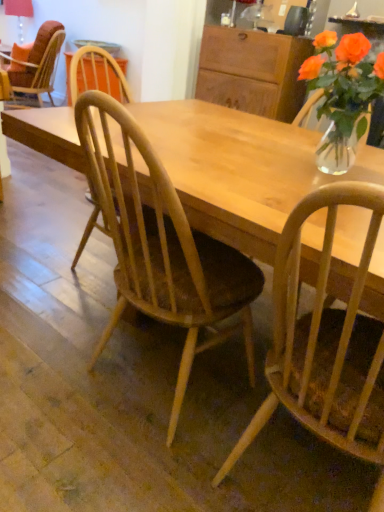
Where is `translucent glass vase at upper right`? The height and width of the screenshot is (512, 384). translucent glass vase at upper right is located at coordinates (342, 94).

Where is `light wood chair at center, which is the 2th chair in front-to-back order`? light wood chair at center, which is the 2th chair in front-to-back order is located at coordinates (162, 248).

Describe the element at coordinates (252, 71) in the screenshot. I see `wooden cabinet at upper center` at that location.

Locate an element on the screen. matte orange fabric chair at upper left, the first chair positioned from the back is located at coordinates (39, 64).

Who is taller, light wood chair at center, which is the 2th chair in front-to-back order, or translucent glass vase at upper right?

Standing taller between the two is light wood chair at center, which is the 2th chair in front-to-back order.

Considering the relative positions of light wood chair at center, which is the 2th chair from bottom to top, and translucent glass vase at upper right in the image provided, is light wood chair at center, which is the 2th chair from bottom to top, behind translucent glass vase at upper right?

No, the depth of light wood chair at center, which is the 2th chair from bottom to top, is less than that of translucent glass vase at upper right.

Is light wood chair at center, which is the 2th chair in front-to-back order, situated inside translucent glass vase at upper right or outside?

light wood chair at center, which is the 2th chair in front-to-back order, is spatially situated outside translucent glass vase at upper right.

Which is farther from the camera, (117, 221) or (337, 145)?

Positioned behind is point (337, 145).

How different are the orientations of matte orange fabric chair at upper left, the 1th chair from the left, and wooden cabinet at upper center in degrees?

The angle between the facing direction of matte orange fabric chair at upper left, the 1th chair from the left, and the facing direction of wooden cabinet at upper center is 0.476 degrees.

Which of these two, matte orange fabric chair at upper left, placed as the first chair when sorted from top to bottom, or wooden cabinet at upper center, is bigger?

Bigger between the two is matte orange fabric chair at upper left, placed as the first chair when sorted from top to bottom.

Which object is further away from the camera taking this photo, matte orange fabric chair at upper left, acting as the third chair starting from the bottom, or wooden cabinet at upper center?

matte orange fabric chair at upper left, acting as the third chair starting from the bottom, is further away from the camera.

From the image's perspective, between matte orange fabric chair at upper left, placed as the first chair when sorted from top to bottom, and wooden cabinet at upper center, who is located below?

wooden cabinet at upper center.

Measure the distance between wooden cabinet at upper center and natural wood chair at center, positioned as the first chair in bottom-to-top order.

wooden cabinet at upper center and natural wood chair at center, positioned as the first chair in bottom-to-top order, are 2.50 meters apart.

In the scene shown: Is wooden cabinet at upper center in front of natural wood chair at center, positioned as the first chair in bottom-to-top order?

That is False.

Is natural wood chair at center, placed as the 3th chair when sorted from left to right, a part of wooden cabinet at upper center?

Definitely not — natural wood chair at center, placed as the 3th chair when sorted from left to right, is not inside wooden cabinet at upper center.

There is a natural wood chair at center, positioned as the first chair in bottom-to-top order. What are the coordinates of `cabinetry above it (from a real-world perspective)` in the screenshot? It's located at (252, 71).

Is matte orange fabric chair at upper left, positioned as the third chair in right-to-left order, facing towards light wood chair at center, arranged as the 2th chair when viewed from the right?

No, matte orange fabric chair at upper left, positioned as the third chair in right-to-left order, is not turned towards light wood chair at center, arranged as the 2th chair when viewed from the right.

Is matte orange fabric chair at upper left, positioned as the third chair in right-to-left order, thinner than light wood chair at center, placed as the 2th chair when sorted from left to right?

Incorrect, the width of matte orange fabric chair at upper left, positioned as the third chair in right-to-left order, is not less than that of light wood chair at center, placed as the 2th chair when sorted from left to right.

From a real-world perspective, between matte orange fabric chair at upper left, placed as the first chair when sorted from top to bottom, and light wood chair at center, acting as the second chair starting from the back, who is vertically lower?

In real-world perspective, light wood chair at center, acting as the second chair starting from the back, is lower.

This screenshot has width=384, height=512. In order to click on chair that is the 1st one when counting rightward from the matte orange fabric chair at upper left, placed as the first chair when sorted from top to bottom in this screenshot , I will do `click(162, 248)`.

How different are the orientations of translucent glass vase at upper right and wooden cabinet at upper center in degrees?

translucent glass vase at upper right and wooden cabinet at upper center are facing 89.1 degrees away from each other.

Consider the image. Which of these two, translucent glass vase at upper right or wooden cabinet at upper center, is thinner?

Thinner between the two is translucent glass vase at upper right.

In the scene shown: From the image's perspective, is translucent glass vase at upper right located above or below wooden cabinet at upper center?

Based on their image positions, translucent glass vase at upper right is located beneath wooden cabinet at upper center.

Between translucent glass vase at upper right and wooden cabinet at upper center, which one has larger size?

wooden cabinet at upper center.

Does matte orange fabric chair at upper left, which ranks as the 3th chair in front-to-back order, have a greater width compared to natural wood chair at center, positioned as the first chair in bottom-to-top order?

Yes, matte orange fabric chair at upper left, which ranks as the 3th chair in front-to-back order, is wider than natural wood chair at center, positioned as the first chair in bottom-to-top order.

Can you tell me how much matte orange fabric chair at upper left, acting as the third chair starting from the bottom, and natural wood chair at center, the 1th chair viewed from the right, differ in facing direction?

The facing directions of matte orange fabric chair at upper left, acting as the third chair starting from the bottom, and natural wood chair at center, the 1th chair viewed from the right, are 178 degrees apart.

Image resolution: width=384 pixels, height=512 pixels. I want to click on the 2nd chair positioned below the matte orange fabric chair at upper left, which ranks as the 3th chair in front-to-back order (from a real-world perspective), so [325, 341].

Between matte orange fabric chair at upper left, placed as the first chair when sorted from top to bottom, and natural wood chair at center, placed as the third chair when sorted from back to front, which one has less height?

With less height is matte orange fabric chair at upper left, placed as the first chair when sorted from top to bottom.

Consider the image. Is natural wood chair at center, placed as the 1th chair when sorted from front to back, bigger or smaller than translucent glass vase at upper right?

In the image, natural wood chair at center, placed as the 1th chair when sorted from front to back, appears to be larger than translucent glass vase at upper right.

You are a GUI agent. You are given a task and a screenshot of the screen. Output one action in this format:
    pyautogui.click(x=<x>, y=<y>)
    Task: Click on the houseplant lying on the right of natural wood chair at center, arranged as the third chair when viewed from the top
    
    Given the screenshot: What is the action you would take?
    pyautogui.click(x=342, y=94)

Consider the image. Does natural wood chair at center, positioned as the first chair in bottom-to-top order, come behind translucent glass vase at upper right?

That is False.

What's the angular difference between natural wood chair at center, placed as the 3th chair when sorted from left to right, and translucent glass vase at upper right's facing directions?

There is a 88.6-degree angle between the facing directions of natural wood chair at center, placed as the 3th chair when sorted from left to right, and translucent glass vase at upper right.

What are the coordinates of `houseplant that is behind the light wood chair at center, acting as the second chair starting from the back` in the screenshot? It's located at (342, 94).

From a real-world perspective, which chair is the 1st one underneath the wooden cabinet at upper center? Please provide its 2D coordinates.

[(39, 64)]

From the image, which object appears to be nearer to wooden cabinet at upper center, matte orange fabric chair at upper left, positioned as the third chair in right-to-left order, or light wood chair at center, which is the 2th chair in front-to-back order?

matte orange fabric chair at upper left, positioned as the third chair in right-to-left order, is positioned closer to the anchor wooden cabinet at upper center.

From the image, which object appears to be farther from translucent glass vase at upper right, matte orange fabric chair at upper left, the first chair positioned from the back, or natural wood chair at center, placed as the third chair when sorted from back to front?

The object further to translucent glass vase at upper right is matte orange fabric chair at upper left, the first chair positioned from the back.

Considering their positions, is natural wood chair at center, placed as the 1th chair when sorted from front to back, positioned further to translucent glass vase at upper right than wooden cabinet at upper center?

wooden cabinet at upper center is positioned further to the anchor translucent glass vase at upper right.

Which object lies nearer to the anchor point light wood chair at center, which is the 2th chair in front-to-back order, wooden cabinet at upper center or natural wood chair at center, placed as the 3th chair when sorted from left to right?

Among the two, natural wood chair at center, placed as the 3th chair when sorted from left to right, is located nearer to light wood chair at center, which is the 2th chair in front-to-back order.

When comparing their distances from translucent glass vase at upper right, does light wood chair at center, acting as the second chair starting from the back, or wooden cabinet at upper center seem closer?

light wood chair at center, acting as the second chair starting from the back, is positioned closer to the anchor translucent glass vase at upper right.

Looking at this image, which object lies nearer to the anchor point matte orange fabric chair at upper left, acting as the third chair starting from the bottom, wooden cabinet at upper center or light wood chair at center, acting as the second chair starting from the back?

The object closer to matte orange fabric chair at upper left, acting as the third chair starting from the bottom, is wooden cabinet at upper center.

Based on their spatial positions, is wooden cabinet at upper center or natural wood chair at center, positioned as the first chair in bottom-to-top order, closer to matte orange fabric chair at upper left, which ranks as the 3th chair in front-to-back order?

wooden cabinet at upper center lies closer to matte orange fabric chair at upper left, which ranks as the 3th chair in front-to-back order, than the other object.

Estimate the real-world distances between objects in this image. Which object is closer to natural wood chair at center, arranged as the third chair when viewed from the top, light wood chair at center, arranged as the 2th chair when viewed from the right, or matte orange fabric chair at upper left, placed as the first chair when sorted from top to bottom?

light wood chair at center, arranged as the 2th chair when viewed from the right.

Image resolution: width=384 pixels, height=512 pixels. Find the location of `cabinetry between translucent glass vase at upper right and matte orange fabric chair at upper left, the 1th chair from the left, in the front-back direction`. cabinetry between translucent glass vase at upper right and matte orange fabric chair at upper left, the 1th chair from the left, in the front-back direction is located at coordinates (252, 71).

At what (x,y) coordinates should I click in order to perform the action: click on houseplant between natural wood chair at center, the 1th chair viewed from the right, and wooden cabinet at upper center in the front-back direction. Please return your answer as a coordinate pair (x, y). The image size is (384, 512). Looking at the image, I should click on (342, 94).

Locate an element on the screen. The height and width of the screenshot is (512, 384). chair that lies between translucent glass vase at upper right and natural wood chair at center, arranged as the third chair when viewed from the top, from top to bottom is located at coordinates (162, 248).

Where is `houseplant between natural wood chair at center, placed as the 3th chair when sorted from left to right, and matte orange fabric chair at upper left, positioned as the third chair in right-to-left order, from front to back`? The width and height of the screenshot is (384, 512). houseplant between natural wood chair at center, placed as the 3th chair when sorted from left to right, and matte orange fabric chair at upper left, positioned as the third chair in right-to-left order, from front to back is located at coordinates (342, 94).